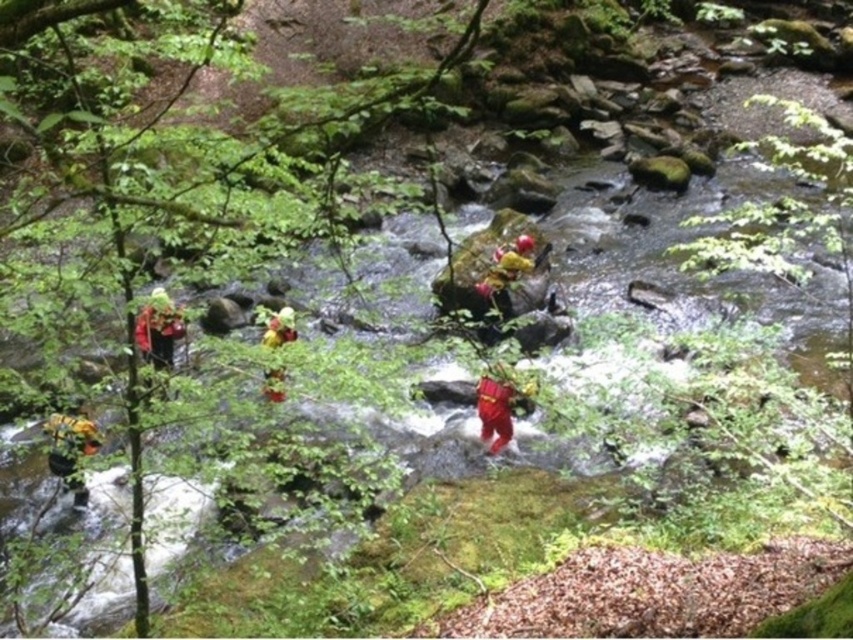
Is matte red helmet at left thinner than yellow fabric person at center?

Yes.

Does matte red helmet at left have a greater height compared to yellow fabric person at center?

No, matte red helmet at left is not taller than yellow fabric person at center.

Is point (164, 353) positioned in front of point (524, 240)?

That is True.

What are the coordinates of `matte red helmet at left` in the screenshot? It's located at (158, 328).

Between point (492, 387) and point (502, 289), which one is positioned behind?

The point (502, 289) is more distant.

Can you confirm if matte red pants at center is smaller than yellow fabric person at center?

Yes, matte red pants at center is smaller than yellow fabric person at center.

You are a GUI agent. You are given a task and a screenshot of the screen. Output one action in this format:
    pyautogui.click(x=<x>, y=<y>)
    Task: Click on the matte red pants at center
    The width and height of the screenshot is (853, 640).
    Given the screenshot: What is the action you would take?
    coord(494,410)

Who is higher up, yellow-orange helmet at lower left or yellow fabric person at center?

yellow fabric person at center is higher up.

Is yellow-orange helmet at lower left wider than yellow fabric person at center?

Incorrect, yellow-orange helmet at lower left's width does not surpass yellow fabric person at center's.

Which is behind, point (78, 406) or point (532, 260)?

Positioned behind is point (532, 260).

Locate an element on the screen. yellow-orange helmet at lower left is located at coordinates (71, 448).